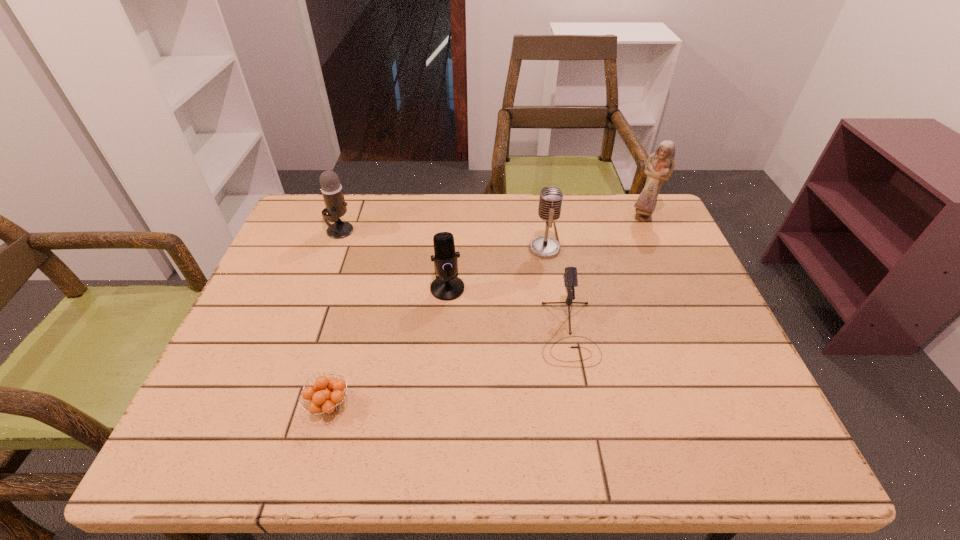
In order to click on free area in between the second object from left to right and the fifth tallest object in this screenshot , I will do `click(448, 369)`.

Find the location of a particular element. The height and width of the screenshot is (540, 960). vacant space that is in between the fifth tallest object and the rightmost object is located at coordinates (606, 274).

Where is `free space between the fifth object from right to left and the leftmost object`? This screenshot has width=960, height=540. free space between the fifth object from right to left and the leftmost object is located at coordinates [334, 318].

I want to click on object that stands as the third closest to the fifth object from right to left, so click(x=331, y=189).

Where is `object that stands as the closest to the shortest object`? The image size is (960, 540). object that stands as the closest to the shortest object is located at coordinates (447, 286).

What are the coordinates of `microphone object that ranks as the second closest to the leftmost object` in the screenshot? It's located at (550, 201).

Image resolution: width=960 pixels, height=540 pixels. In order to click on microphone that is the third nearest to the shortest object in this screenshot , I will do `click(331, 189)`.